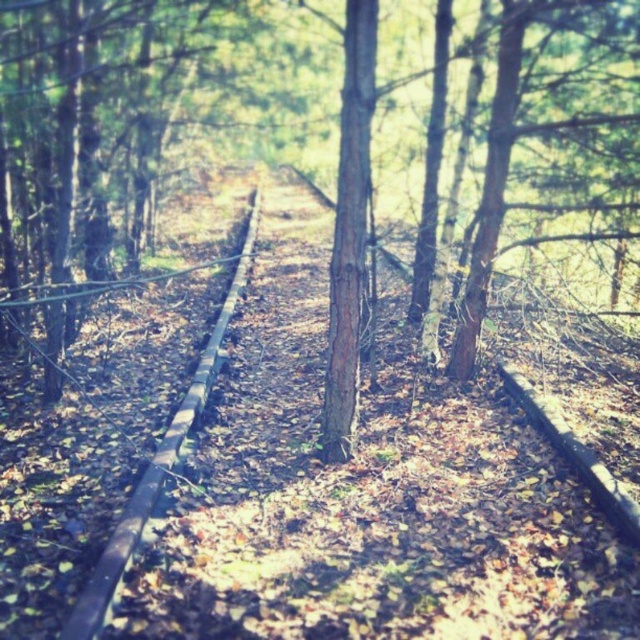
Between brown rough bark tree at center and brown wooden train track at center, which one appears on the left side from the viewer's perspective?

brown wooden train track at center is more to the left.

Is point (348, 294) closer to camera compared to point (195, 410)?

Yes, point (348, 294) is in front of point (195, 410).

At what (x,y) coordinates should I click in order to perform the action: click on brown rough bark tree at center. Please return your answer as a coordinate pair (x, y). Looking at the image, I should click on point(349,230).